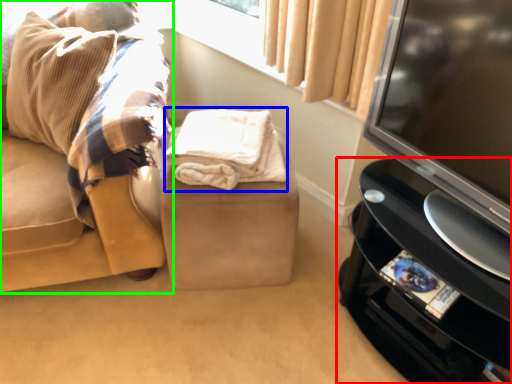
Question: Which object is positioned farthest from furniture (highlighted by a red box)? Select from blanket (highlighted by a blue box) and studio couch (highlighted by a green box).

Choices:
 (A) blanket
 (B) studio couch

Answer: (B)